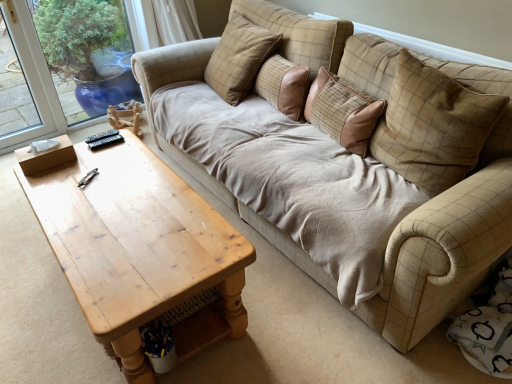
Question: From the image's perspective, is brown fabric pillow at center, the third pillow viewed from the right, above or below beige fabric couch at center?

Choices:
 (A) above
 (B) below

Answer: (A)

Question: From their relative heights in the image, would you say brown fabric pillow at center, the third pillow viewed from the right, is taller or shorter than beige fabric couch at center?

Choices:
 (A) short
 (B) tall

Answer: (B)

Question: Which object is positioned closest to the beige checkered pillow at upper center, marked as the fourth pillow in a right-to-left arrangement?

Choices:
 (A) brown fabric pillow at center, placed as the 2th pillow when sorted from left to right
 (B) plaid fabric pillow at upper right, which is the fourth pillow from left to right
 (C) light brown wooden coffee table at left
 (D) beige checkered pillow at upper center, which is the second pillow in right-to-left order
 (E) beige fabric couch at center

Answer: (A)

Question: Which object is the closest to the light brown wooden coffee table at left?

Choices:
 (A) brown fabric pillow at center, placed as the 2th pillow when sorted from left to right
 (B) beige checkered pillow at upper center, which is the second pillow in right-to-left order
 (C) beige fabric couch at center
 (D) plaid fabric pillow at upper right, which is the fourth pillow from left to right
 (E) beige checkered pillow at upper center, which ranks as the first pillow in left-to-right order

Answer: (C)